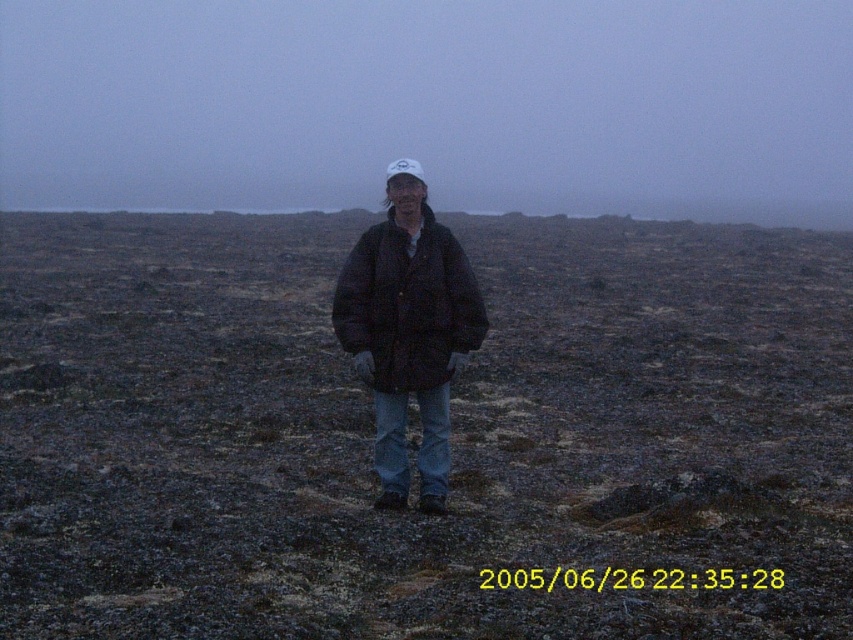
You are a hiker who wants to place a marker at the point marked by point (451, 433) in the image. What type of terrain should you expect to find there?

The point (451, 433) is on dark brown soil at center, so you should expect to find dark brown soil at center there.